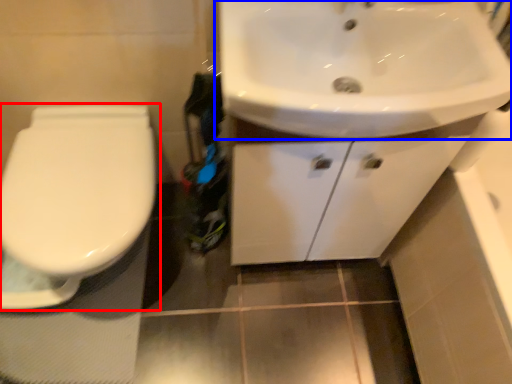
Question: Among these objects, which one is farthest to the camera, toilet (highlighted by a red box) or sink (highlighted by a blue box)?

Choices:
 (A) toilet
 (B) sink

Answer: (A)